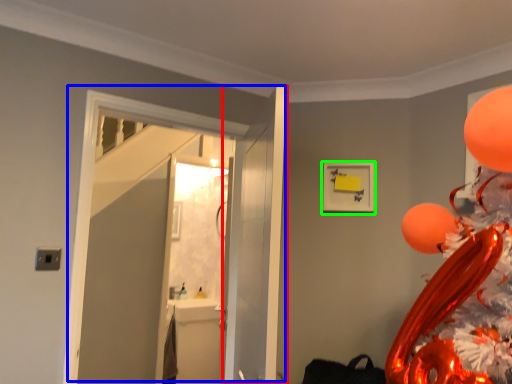
Question: Estimate the real-world distances between objects in this image. Which object is closer to door (highlighted by a red box), door (highlighted by a blue box) or picture frame (highlighted by a green box)?

Choices:
 (A) door
 (B) picture frame

Answer: (A)